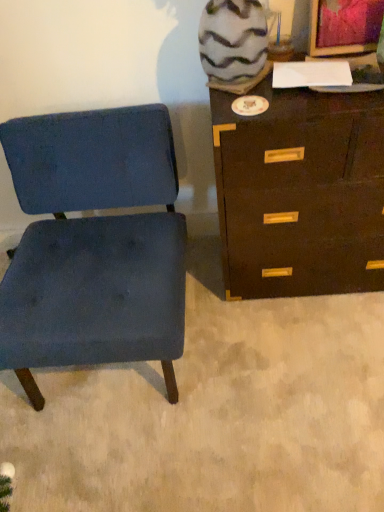
You are a GUI agent. You are given a task and a screenshot of the screen. Output one action in this format:
    pyautogui.click(x=<x>, y=<y>)
    Task: Click on the free space between dark brown wood chest of drawers at right and blue fabric chair at left
    
    Given the screenshot: What is the action you would take?
    pyautogui.click(x=266, y=328)